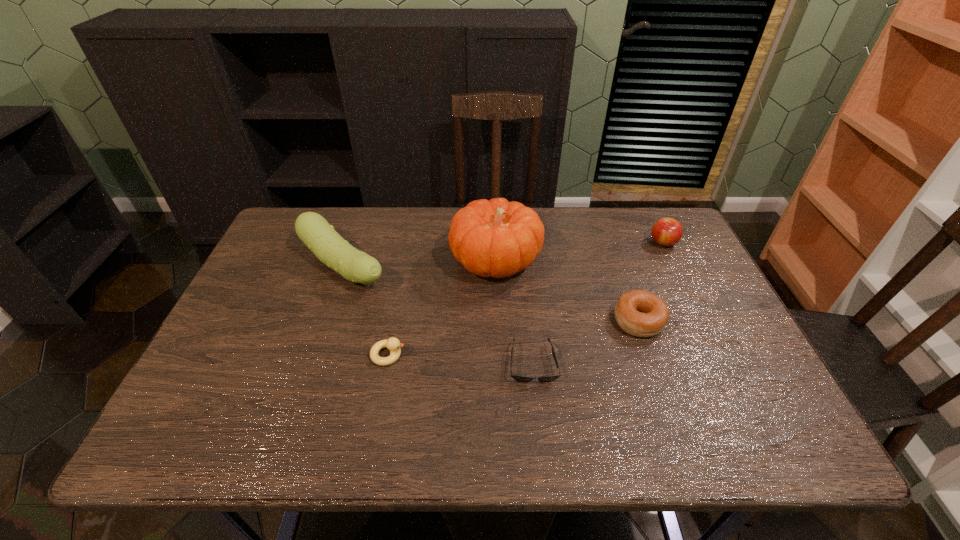
The width and height of the screenshot is (960, 540). Identify the location of object that is at the far right corner. (666, 232).

In order to click on vacant space at the far edge of the desktop in this screenshot , I will do `click(624, 242)`.

This screenshot has height=540, width=960. Identify the location of free point at the near edge. (656, 423).

Find the location of a particular element. This screenshot has height=540, width=960. blank space at the left edge of the desktop is located at coordinates [292, 272].

Locate an element on the screen. The width and height of the screenshot is (960, 540). vacant area at the right edge of the desktop is located at coordinates (716, 395).

The image size is (960, 540). In order to click on vacant space at the far left corner in this screenshot , I will do `click(327, 215)`.

I want to click on free area in between the sunglasses and the apple, so click(x=598, y=303).

Locate an element on the screen. This screenshot has width=960, height=540. free space between the duckling and the rightmost object is located at coordinates (525, 299).

Identify the location of vacant point located between the pumpkin and the shortest object. Image resolution: width=960 pixels, height=540 pixels. (514, 313).

The width and height of the screenshot is (960, 540). Identify the location of vacant space in between the apple and the tallest object. (579, 252).